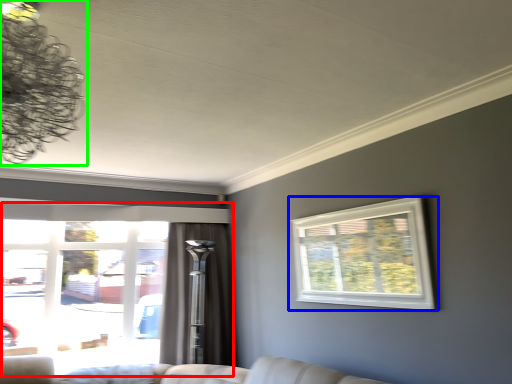
Question: Which object is the farthest from window (highlighted by a red box)? Choose among these: window (highlighted by a blue box) or lamp (highlighted by a green box).

Choices:
 (A) window
 (B) lamp

Answer: (B)